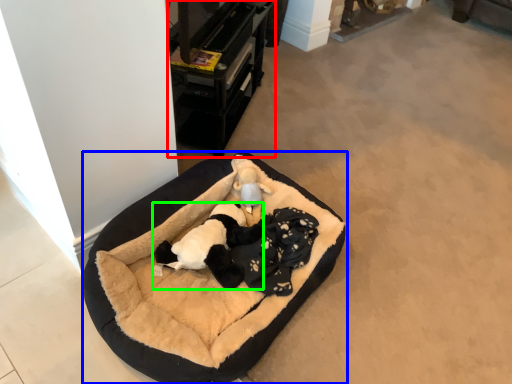
Question: Which object is the closest to the furniture (highlighted by a red box)? Choose among these: dog bed (highlighted by a blue box) or animal (highlighted by a green box).

Choices:
 (A) dog bed
 (B) animal

Answer: (A)